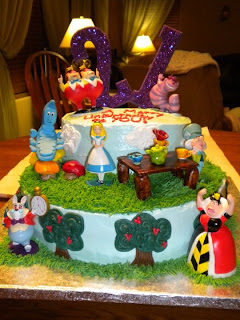
Identify the location of lamp shade. (144, 43).